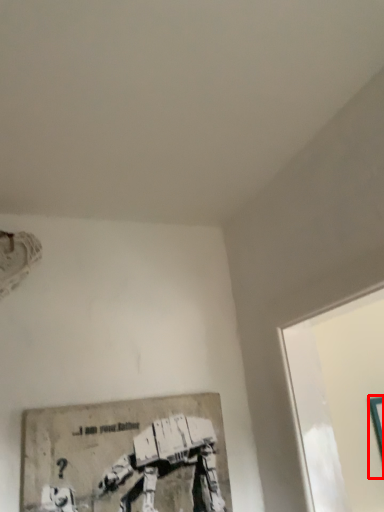
Question: Considering the relative positions of picture frame (annotated by the red box) and picture frame in the image provided, where is picture frame (annotated by the red box) located with respect to the staircase?

Choices:
 (A) right
 (B) left

Answer: (A)